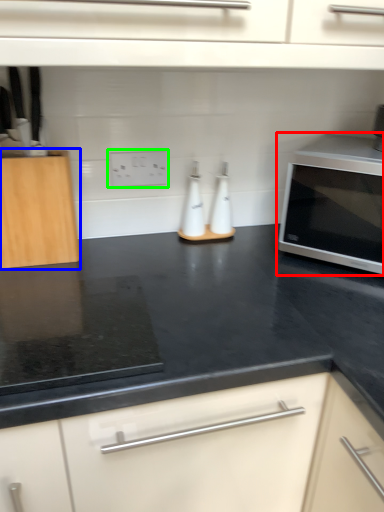
Question: Which object is positioned farthest from microwave oven (highlighted by a red box)? Select from cabinetry (highlighted by a blue box) and electric outlet (highlighted by a green box).

Choices:
 (A) cabinetry
 (B) electric outlet

Answer: (A)